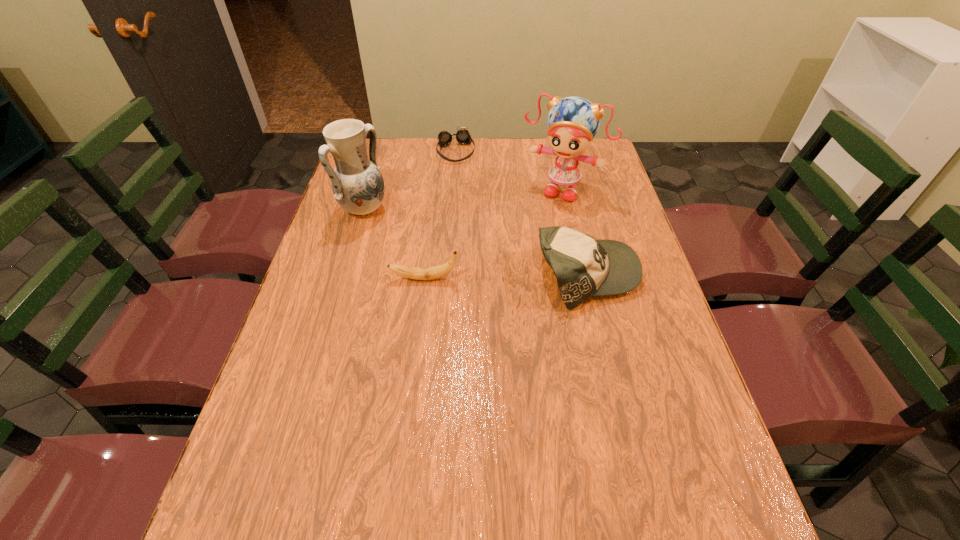
You are a GUI agent. You are given a task and a screenshot of the screen. Output one action in this format:
    pyautogui.click(x=<x>, y=<y>)
    Task: Click on the free space between the banana and the leftmost object
    The width and height of the screenshot is (960, 540).
    Given the screenshot: What is the action you would take?
    pyautogui.click(x=394, y=245)

Find the location of a particular element. blank region between the goggles and the doll is located at coordinates (509, 170).

This screenshot has width=960, height=540. I want to click on free space between the fourth tallest object and the leftmost object, so click(394, 245).

Locate an element on the screen. empty space between the second shortest object and the leftmost object is located at coordinates (394, 245).

You are a GUI agent. You are given a task and a screenshot of the screen. Output one action in this format:
    pyautogui.click(x=<x>, y=<y>)
    Task: Click on the free spot between the doll and the banana
    
    Given the screenshot: What is the action you would take?
    pyautogui.click(x=493, y=233)

Image resolution: width=960 pixels, height=540 pixels. What are the coordinates of `the fourth closest object to the leftmost object` in the screenshot? It's located at (584, 267).

At what (x,y) coordinates should I click in order to perform the action: click on object that ranks as the second closest to the banana. Please return your answer as a coordinate pair (x, y). The height and width of the screenshot is (540, 960). Looking at the image, I should click on (584, 267).

This screenshot has width=960, height=540. I want to click on free location that satisfies the following two spatial constraints: 1. on the front side of the pottery; 2. on the peel of the banana from the top, so click(x=344, y=279).